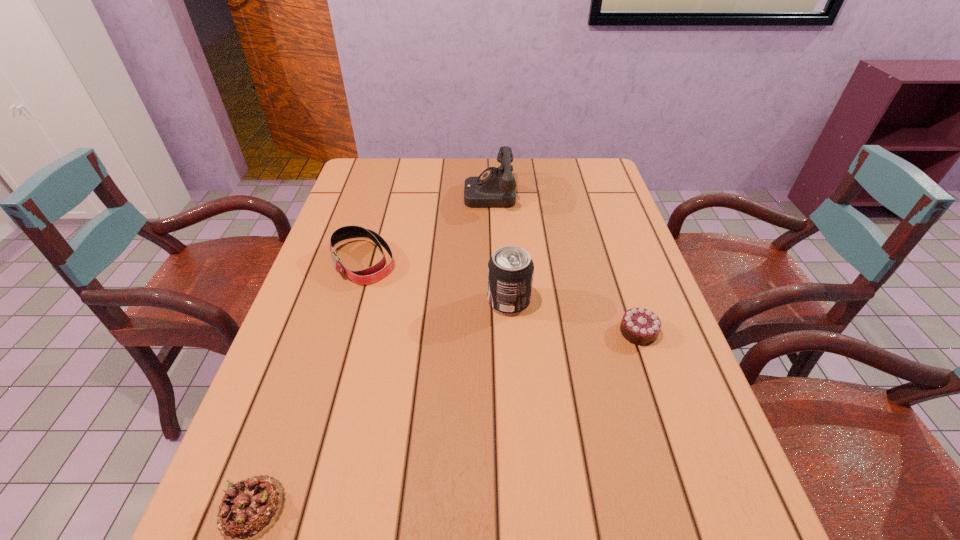
This screenshot has height=540, width=960. Find the location of `the farthest object`. the farthest object is located at coordinates (495, 187).

Where is `soda can`? The image size is (960, 540). soda can is located at coordinates (510, 270).

Where is `the third tallest object`? the third tallest object is located at coordinates click(370, 275).

Where is `the farther chocolate cake`? the farther chocolate cake is located at coordinates (639, 326).

You are a GUI agent. You are given a task and a screenshot of the screen. Output one action in this format:
    pyautogui.click(x=<x>, y=<y>)
    Task: Click on the fourth farthest object
    The image size is (960, 540).
    Given the screenshot: What is the action you would take?
    pyautogui.click(x=639, y=326)

Locate an element on the screen. Image resolution: width=960 pixels, height=540 pixels. vacant space located on the dial of the telephone is located at coordinates (430, 193).

Locate an element on the screen. vacant space located 0.060m on the dial of the telephone is located at coordinates (445, 193).

Image resolution: width=960 pixels, height=540 pixels. In order to click on vacant area situated 0.320m on the dial of the telephone in this screenshot , I will do `click(366, 193)`.

Locate an element on the screen. free space located on the left of the soda can is located at coordinates (385, 301).

Image resolution: width=960 pixels, height=540 pixels. I want to click on free space located 0.360m on the right of the third shortest object, so click(x=530, y=261).